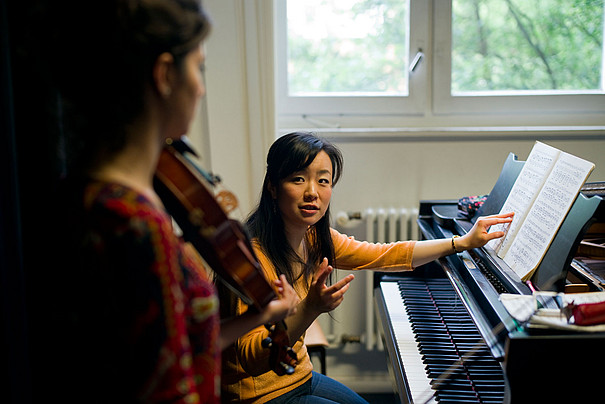
This screenshot has height=404, width=605. What are the coordinates of `piano` in the screenshot? It's located at (540, 366).